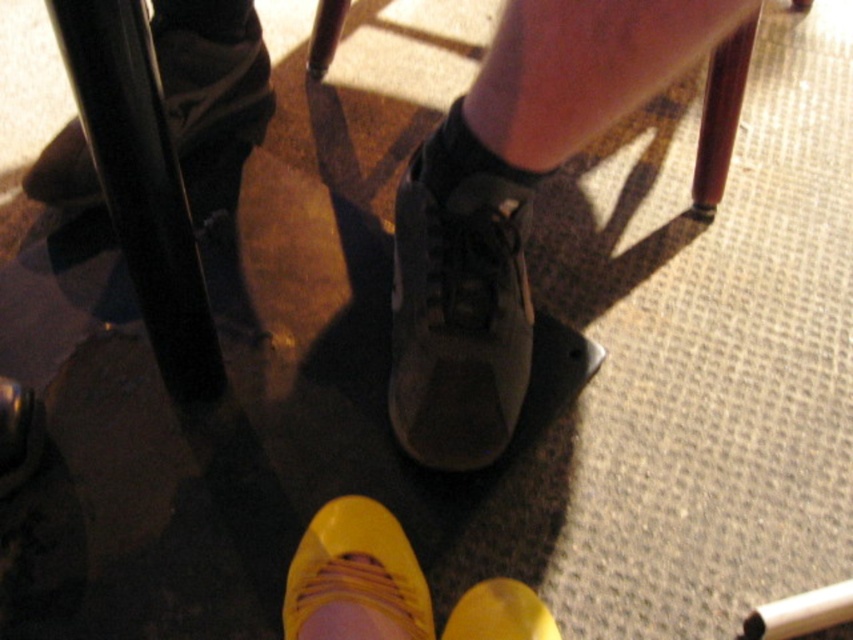
You are a photographer setting up a shoot in a room with two models. One model is wearing a matte black sneaker at center and another is wearing a shiny black shoe at lower center. The photographer wants to ensure both shoes are visible in the final photo. Based on their positions, which shoe might partially block the view of the other?

The shiny black shoe at lower center is positioned behind the matte black sneaker at center, so it might be partially blocked from view by the sneaker.

In the scene shown: You are holding a camera and want to take a photo of the matte black sneaker at center. If the camera is currently 31.98 inches away from the sneaker, is this distance within the recommended focus range of 24 to 36 inches for clear photos?

The distance between the matte black sneaker at center and the camera is exactly 31.98 inches, which falls within the recommended focus range of 24 to 36 inches. Therefore, this distance is suitable for taking a clear photo.

You are standing in a room and see the matte black shoe at lower left and the shiny black shoe at lower center. Which shoe is positioned more to the right side?

The matte black shoe at lower left is positioned more to the right side than the shiny black shoe at lower center.